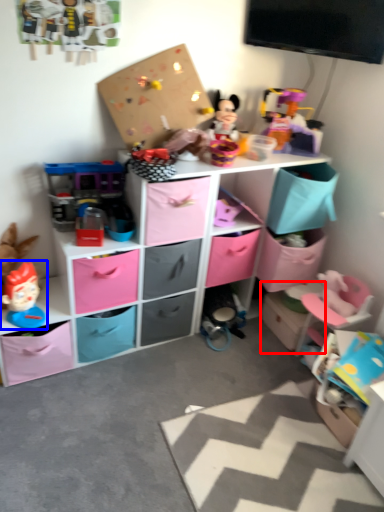
Question: Which of the following is the closest to the observer, storage box (highlighted by a red box) or toy (highlighted by a blue box)?

Choices:
 (A) storage box
 (B) toy

Answer: (B)